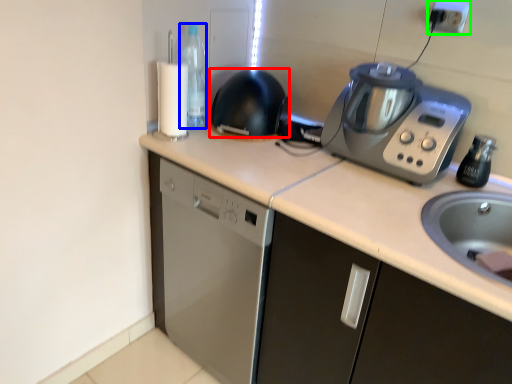
Question: Which object is the closest to the kitchen appliance (highlighted by a red box)? Choose among these: bottle (highlighted by a blue box) or electric outlet (highlighted by a green box).

Choices:
 (A) bottle
 (B) electric outlet

Answer: (A)